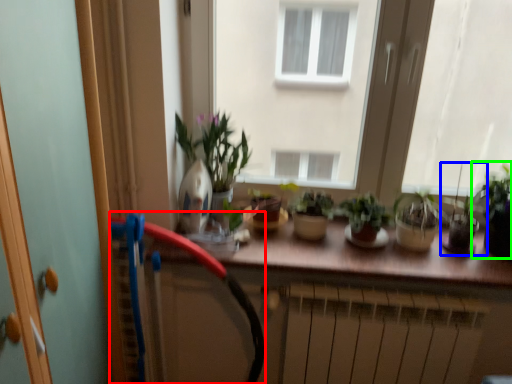
Question: Which is farther away from garden hose (highlighted by a red box)? houseplant (highlighted by a blue box) or houseplant (highlighted by a green box)?

Choices:
 (A) houseplant
 (B) houseplant

Answer: (B)